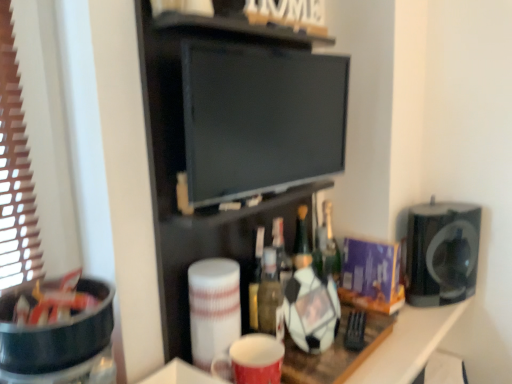
Question: Is black plastic bowl at left, arranged as the 1th appliance when viewed from the left, not inside black glossy flat screen tv at center?

Choices:
 (A) yes
 (B) no

Answer: (A)

Question: Could you tell me if black plastic bowl at left, which is the second appliance in right-to-left order, is facing black glossy flat screen tv at center?

Choices:
 (A) yes
 (B) no

Answer: (B)

Question: Does black plastic bowl at left, arranged as the 1th appliance when viewed from the left, come in front of black glossy flat screen tv at center?

Choices:
 (A) no
 (B) yes

Answer: (B)

Question: Considering the relative sizes of black plastic bowl at left, arranged as the 1th appliance when viewed from the left, and black glossy flat screen tv at center in the image provided, is black plastic bowl at left, arranged as the 1th appliance when viewed from the left, shorter than black glossy flat screen tv at center?

Choices:
 (A) yes
 (B) no

Answer: (A)

Question: Could black glossy flat screen tv at center be considered to be inside black plastic bowl at left, the second appliance in the back-to-front sequence?

Choices:
 (A) yes
 (B) no

Answer: (B)

Question: Does black plastic bowl at left, the second appliance in the back-to-front sequence, have a smaller size compared to black glossy flat screen tv at center?

Choices:
 (A) no
 (B) yes

Answer: (B)

Question: From a real-world perspective, is black matte tv at center beneath translucent glass bottle at center?

Choices:
 (A) yes
 (B) no

Answer: (B)

Question: Is black matte tv at center aimed at translucent glass bottle at center?

Choices:
 (A) yes
 (B) no

Answer: (B)

Question: Does black matte tv at center have a smaller size compared to translucent glass bottle at center?

Choices:
 (A) no
 (B) yes

Answer: (A)

Question: Is black matte tv at center oriented away from translucent glass bottle at center?

Choices:
 (A) no
 (B) yes

Answer: (A)

Question: From the image's perspective, is black matte tv at center on translucent glass bottle at center?

Choices:
 (A) no
 (B) yes

Answer: (B)

Question: Is black matte tv at center behind translucent glass bottle at center?

Choices:
 (A) yes
 (B) no

Answer: (B)

Question: Is translucent glass bottle at center oriented towards black matte speaker at right, the 2th appliance positioned from the left?

Choices:
 (A) yes
 (B) no

Answer: (B)